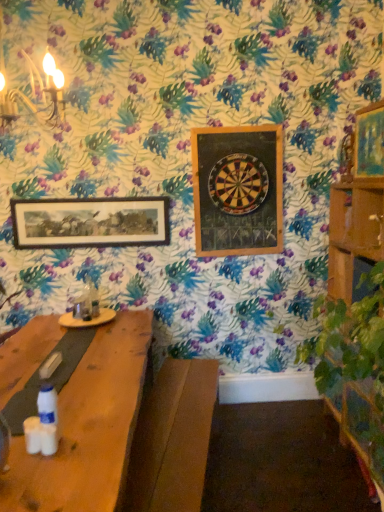
Question: Can you confirm if wooden framed artwork at upper left, which appears as the 3th picture frame when viewed from the front, is smaller than wooden dartboard at center?

Choices:
 (A) yes
 (B) no

Answer: (A)

Question: From the image's perspective, does wooden framed artwork at upper left, acting as the 1th picture frame starting from the back, appear lower than wooden dartboard at center?

Choices:
 (A) yes
 (B) no

Answer: (A)

Question: From a real-world perspective, is wooden framed artwork at upper left, acting as the 1th picture frame starting from the back, physically below wooden dartboard at center?

Choices:
 (A) yes
 (B) no

Answer: (A)

Question: Is wooden dartboard at center at the back of wooden framed artwork at upper left, which appears as the 3th picture frame when viewed from the front?

Choices:
 (A) yes
 (B) no

Answer: (B)

Question: Can you confirm if wooden framed artwork at upper left, which appears as the 3th picture frame when viewed from the front, is positioned to the left of wooden dartboard at center?

Choices:
 (A) yes
 (B) no

Answer: (A)

Question: From the image's perspective, would you say wooden framed artwork at upper left, which appears as the 3th picture frame when viewed from the front, is positioned over wooden dartboard at center?

Choices:
 (A) yes
 (B) no

Answer: (B)

Question: Is wooden dartboard at center far away from wooden framed artwork at upper left, the 3th picture frame viewed from the right?

Choices:
 (A) yes
 (B) no

Answer: (B)

Question: From the image's perspective, is wooden dartboard at center beneath wooden framed artwork at upper left, which appears as the 3th picture frame when viewed from the front?

Choices:
 (A) no
 (B) yes

Answer: (A)

Question: Is wooden dartboard at center positioned before wooden framed artwork at upper left, which appears as the 3th picture frame when viewed from the front?

Choices:
 (A) no
 (B) yes

Answer: (B)

Question: Is wooden dartboard at center oriented towards wooden framed artwork at upper left, acting as the 1th picture frame starting from the back?

Choices:
 (A) no
 (B) yes

Answer: (A)

Question: Is wooden framed artwork at upper left, which appears as the 3th picture frame when viewed from the front, surrounded by wooden dartboard at center?

Choices:
 (A) no
 (B) yes

Answer: (A)

Question: Is wooden dartboard at center positioned beyond the bounds of wooden framed artwork at upper left, the 1th picture frame viewed from the left?

Choices:
 (A) no
 (B) yes

Answer: (B)

Question: Is wooden dartboard at upper center, which is the second picture frame from back to front, positioned far away from wooden dartboard at center?

Choices:
 (A) no
 (B) yes

Answer: (A)